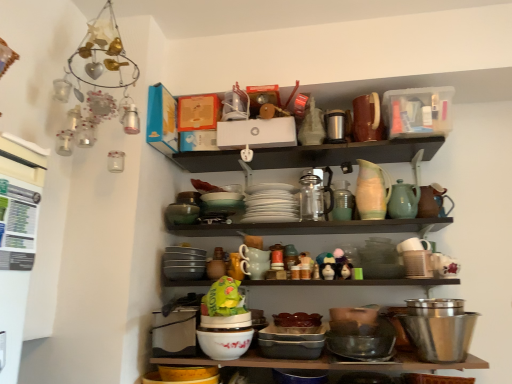
Question: Is matte black bowl at center, which is counted as the first bowl, starting from the left, taller or shorter than green glass jar at center, the fifth tableware in the left-to-right sequence?

Choices:
 (A) short
 (B) tall

Answer: (A)

Question: Looking at the image, does matte black bowl at center, the 3th bowl positioned from the right, seem bigger or smaller compared to green glass jar at center, the fifth tableware in the left-to-right sequence?

Choices:
 (A) small
 (B) big

Answer: (B)

Question: Which is nearer to the stainless steel bowl at lower right, which is the 1th bowl from right to left?

Choices:
 (A) shiny metallic bowl at lower center, which ranks as the second bowl in right-to-left order
 (B) matte ceramic dishes at center, the first shelf when ordered from bottom to top
 (C) green plastic bag at center
 (D) pastel ceramic pitcher at upper center, which appears as the second tableware when viewed from the right
 (E) matte black bowl at center, the 3th bowl positioned from the right

Answer: (A)

Question: Which is nearer to the white matte plates at center, which ranks as the sixth tableware in right-to-left order?

Choices:
 (A) matte black bowl at center, which is counted as the first bowl, starting from the left
 (B) metallic thermos at upper center, arranged as the fourth tableware when viewed from the left
 (C) green plastic bag at center
 (D) speckled ceramic mug at center, acting as the first tableware starting from the left
 (E) matte ceramic dishes at center, acting as the 2th shelf starting from the top

Answer: (D)